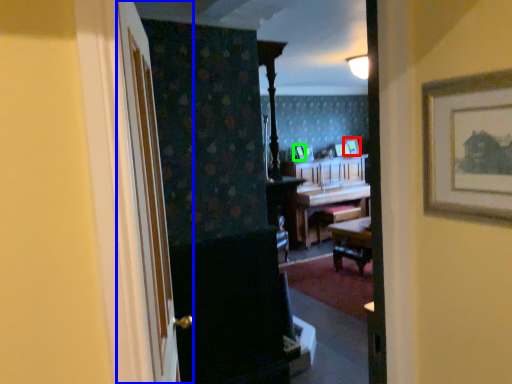
Question: Which object is positioned farthest from picture frame (highlighted by a red box)? Select from door (highlighted by a blue box) and picture frame (highlighted by a green box).

Choices:
 (A) door
 (B) picture frame

Answer: (A)